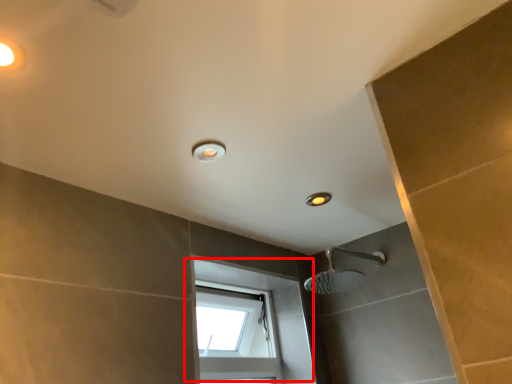
Question: From the image's perspective, what is the correct spatial relationship of window (annotated by the red box) in relation to light fixture?

Choices:
 (A) below
 (B) above

Answer: (A)